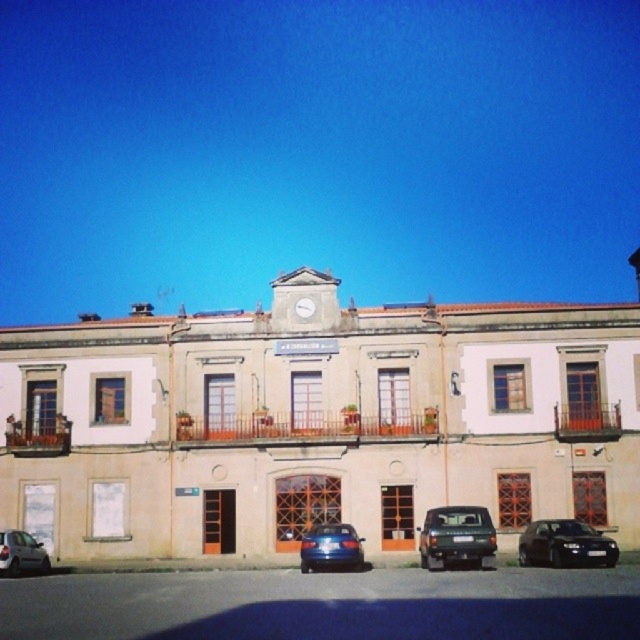
You are standing in front of the building and want to park your car so that it aligns with the white plastic clock at center. Where should you position the black matte car at lower right relative to the clock?

To align the black matte car at lower right with the white plastic clock at center, you should move the black matte car at lower right to the left until it is positioned directly below the clock, as it is currently to the right of the clock.

You are standing in front of the two story building and see the shiny blue sedan at center and the metallic silver car at lower left. Which car is parked higher up relative to the other?

The shiny blue sedan at center is above the metallic silver car at lower left, so it is parked higher up.

You are standing in front of the two story building and want to take a photo. You notice two points marked on the building. The first point is at coordinates point (545, 538) and the second point is at point (301, 300). Which point will appear larger in your photo?

Point (545, 538) is closer to the camera than point (301, 300), so it will appear larger in the photo.